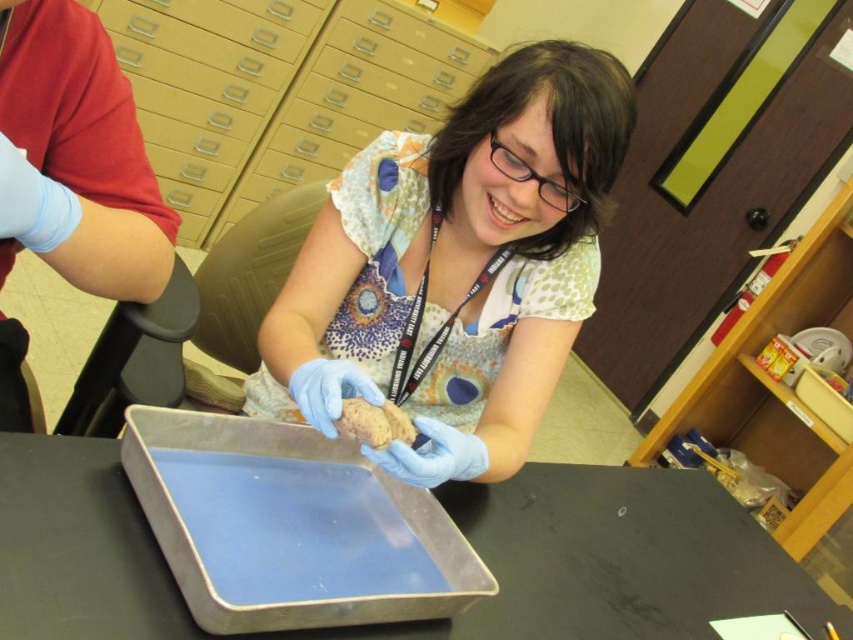
Does point (578, 109) come behind point (257, 634)?

Yes, point (578, 109) is behind point (257, 634).

In the scene shown: Is matte brown rock at center bigger than metallic gray tray at center?

No, matte brown rock at center is not bigger than metallic gray tray at center.

The image size is (853, 640). Describe the element at coordinates (456, 268) in the screenshot. I see `matte brown rock at center` at that location.

Locate an element on the screen. This screenshot has width=853, height=640. matte brown rock at center is located at coordinates (456, 268).